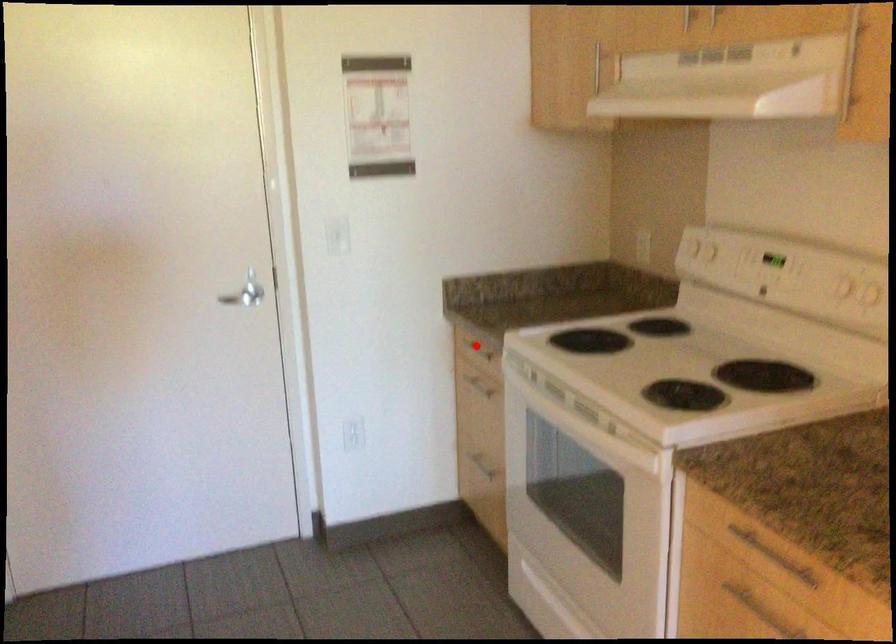
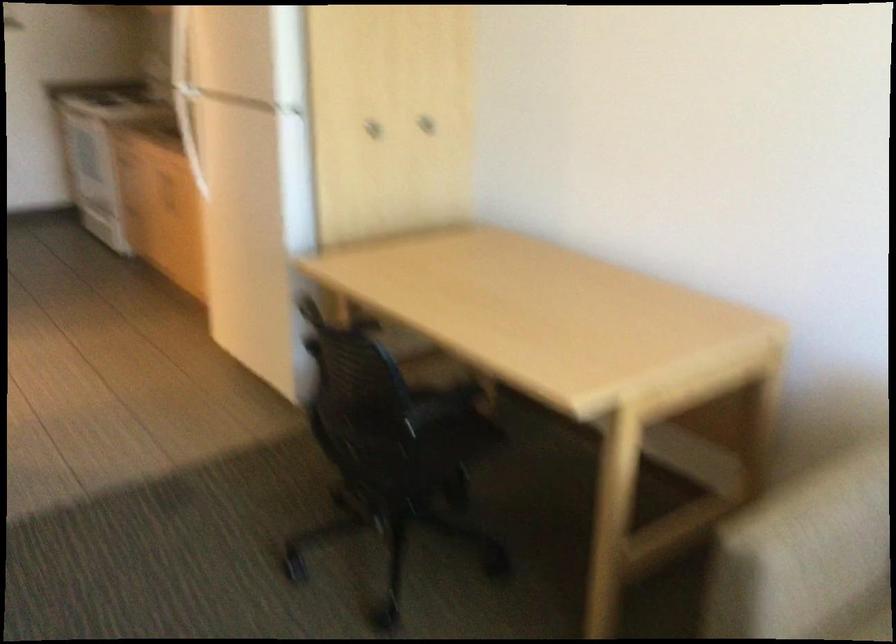
Question: I am providing you with two images of the same scene from different viewpoints. A red point is marked on the first image. Can you still see the location of the red point in image 2?

Choices:
 (A) Yes
 (B) No

Answer: (B)